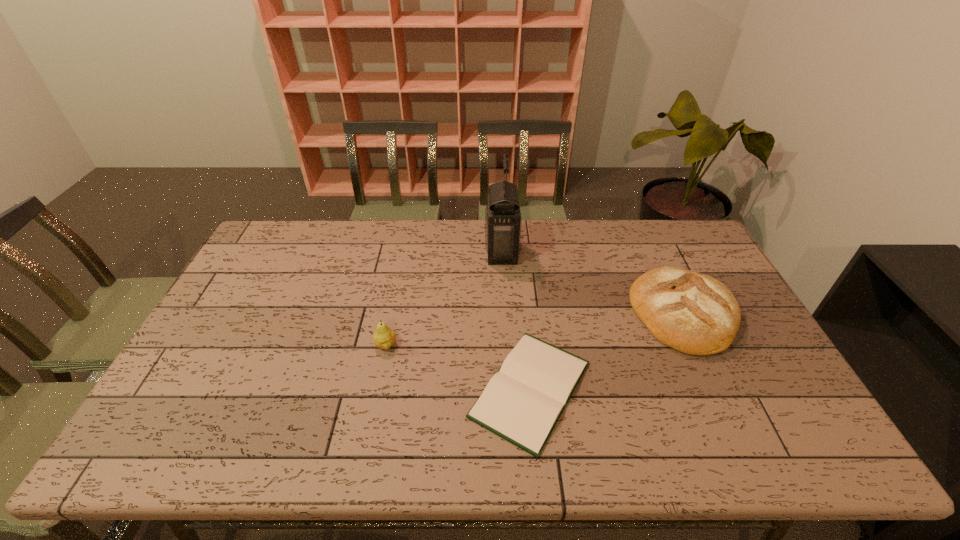
The image size is (960, 540). I want to click on free spot between the leftmost object and the hardback book, so click(458, 367).

Choose which object is the nearest neighbor to the leftmost object. Please provide its 2D coordinates. Your answer should be formatted as a tuple, i.e. [(x, y)], where the tuple contains the x and y coordinates of a point satisfying the conditions above.

[(522, 403)]

Choose which object is the third nearest neighbor to the leftmost object. Please provide its 2D coordinates. Your answer should be formatted as a tuple, i.e. [(x, y)], where the tuple contains the x and y coordinates of a point satisfying the conditions above.

[(691, 312)]

Identify the location of vacant area in the image that satisfies the following two spatial constraints: 1. on the back side of the shortest object; 2. on the front-facing side of the lantern. (517, 252).

You are a GUI agent. You are given a task and a screenshot of the screen. Output one action in this format:
    pyautogui.click(x=<x>, y=<y>)
    Task: Click on the free space that satisfies the following two spatial constraints: 1. on the front-facing side of the tallest object; 2. on the left side of the bread
    The image size is (960, 540).
    Given the screenshot: What is the action you would take?
    pyautogui.click(x=506, y=313)

The image size is (960, 540). Identify the location of free space in the image that satisfies the following two spatial constraints: 1. on the front-facing side of the tallest object; 2. on the right side of the bread. (506, 313).

I want to click on free space in the image that satisfies the following two spatial constraints: 1. on the front-facing side of the shortest object; 2. on the left side of the farthest object, so click(x=510, y=389).

Image resolution: width=960 pixels, height=540 pixels. Identify the location of vacant area in the image that satisfies the following two spatial constraints: 1. on the front-facing side of the hardback book; 2. on the right side of the farthest object. (510, 389).

Where is `vacant point that satisfies the following two spatial constraints: 1. on the front-facing side of the farthest object; 2. on the back side of the shortest object`? This screenshot has height=540, width=960. vacant point that satisfies the following two spatial constraints: 1. on the front-facing side of the farthest object; 2. on the back side of the shortest object is located at coordinates tap(510, 389).

Identify the location of vacant space that satisfies the following two spatial constraints: 1. on the front-facing side of the lantern; 2. on the right side of the hardback book. (510, 389).